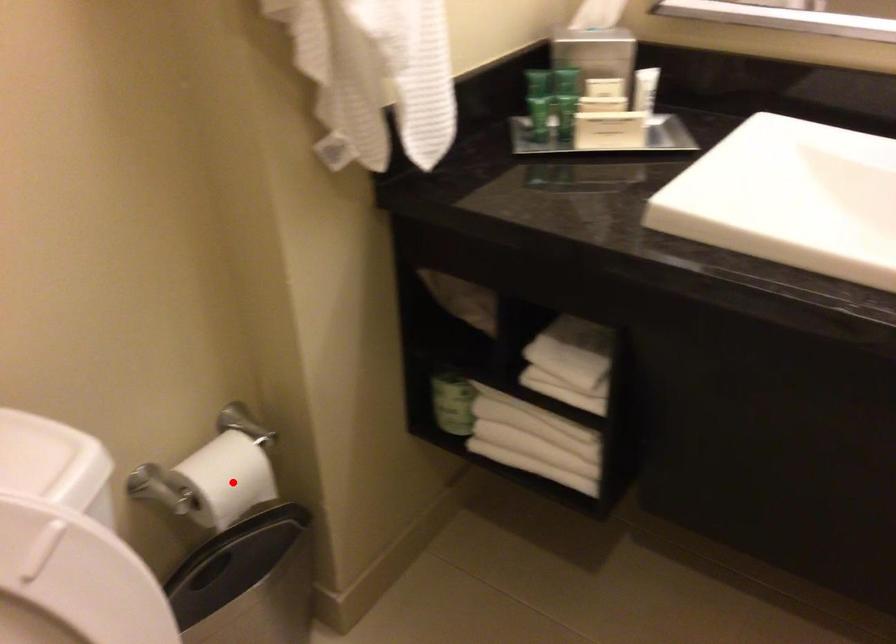
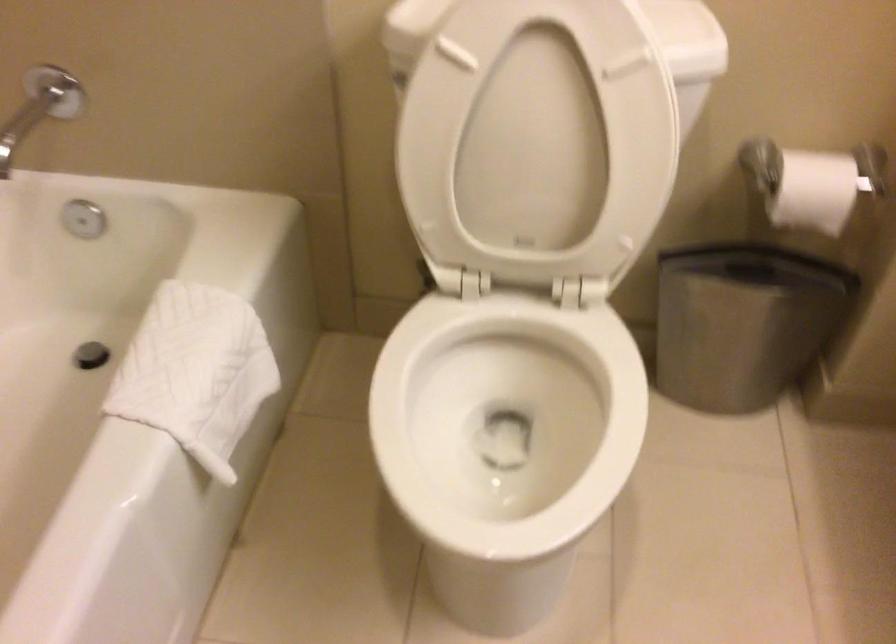
In the second image, find the point that corresponds to the highlighted location in the first image.

(812, 183)